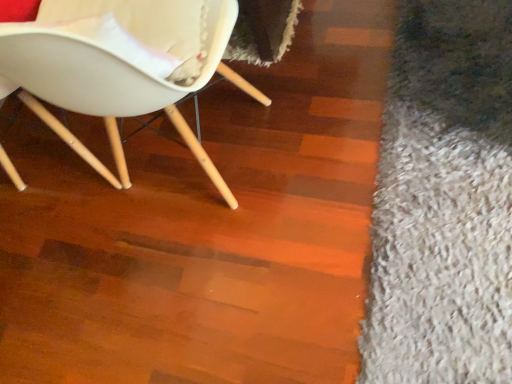
This screenshot has height=384, width=512. I want to click on free spot below white matte plastic chair at upper left (from a real-world perspective), so click(196, 159).